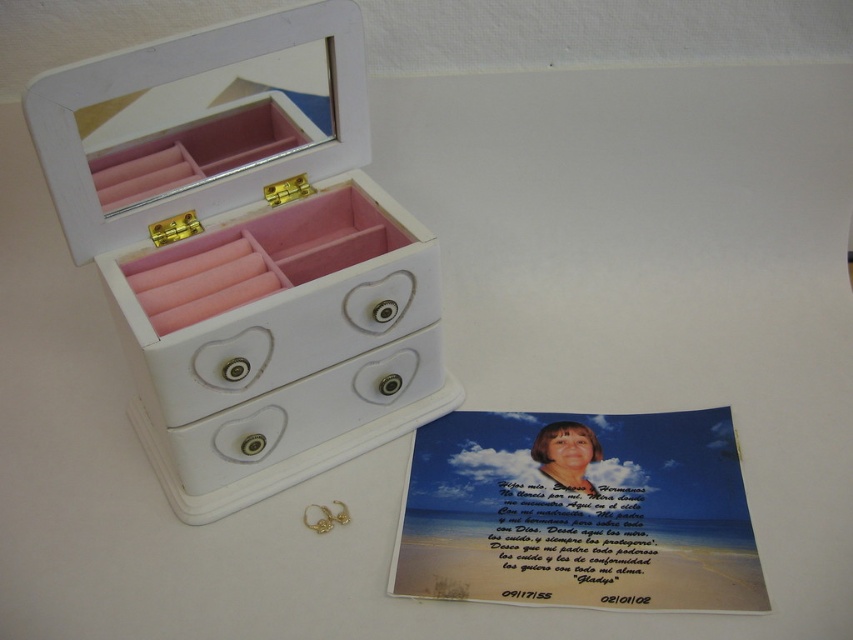
Question: Among these points, which one is farthest from the camera?

Choices:
 (A) (314, 387)
 (B) (196, 342)

Answer: (A)

Question: Can you confirm if white matte jewelry box at center is positioned below white matte drawer at center?

Choices:
 (A) yes
 (B) no

Answer: (B)

Question: Can you confirm if white matte jewelry box at center is positioned to the right of white matte drawer at center?

Choices:
 (A) yes
 (B) no

Answer: (B)

Question: Does white matte jewelry box at center appear on the right side of white matte drawer at center?

Choices:
 (A) yes
 (B) no

Answer: (B)

Question: Among these objects, which one is farthest from the camera?

Choices:
 (A) white matte jewelry box at center
 (B) white matte drawer at center

Answer: (B)